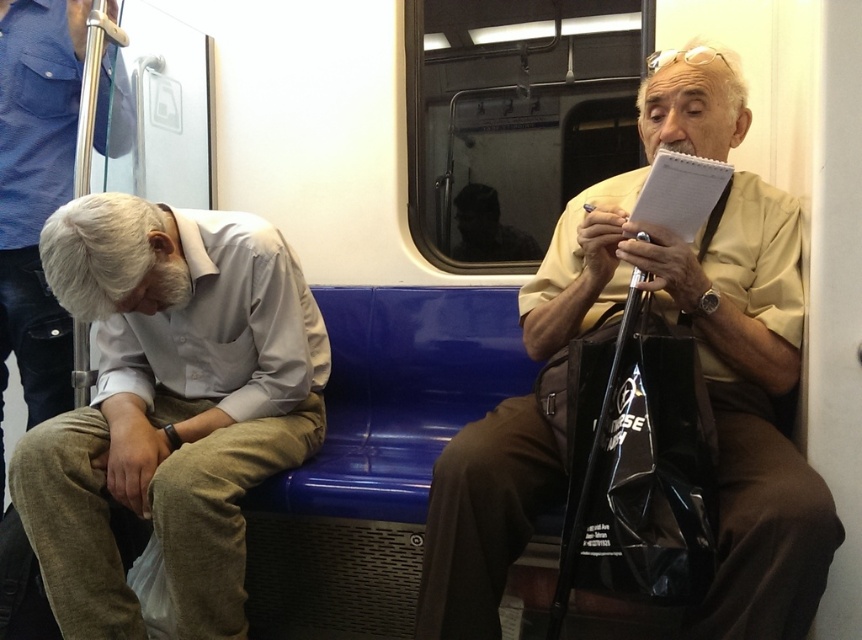
In the subway car scene, there are two shirts visible on the passengers. The yellow matte shirt at upper right and the gray cotton shirt at left. Which shirt is positioned more to the right side of the image?

The yellow matte shirt at upper right is positioned more to the right side of the image.

Based on the photo, you are standing in the subway car and need to find the light gray cotton shirt at lower left. According to the coordinates provided, where exactly is this shirt positioned?

The light gray cotton shirt at lower left is located at point (x=167, y=406), which means it is positioned approximately two thirds of the way from the left edge and nearly a fifth from the bottom edge of the image.

You are standing in the subway car and want to approach the light gray cotton shirt at lower left and the gray cotton shirt at left to ask a question. Which shirt should you walk towards first to reach the closer one?

The light gray cotton shirt at lower left is closer to the viewer than the gray cotton shirt at left, so you should walk towards the light gray cotton shirt at lower left first to reach the closer one.